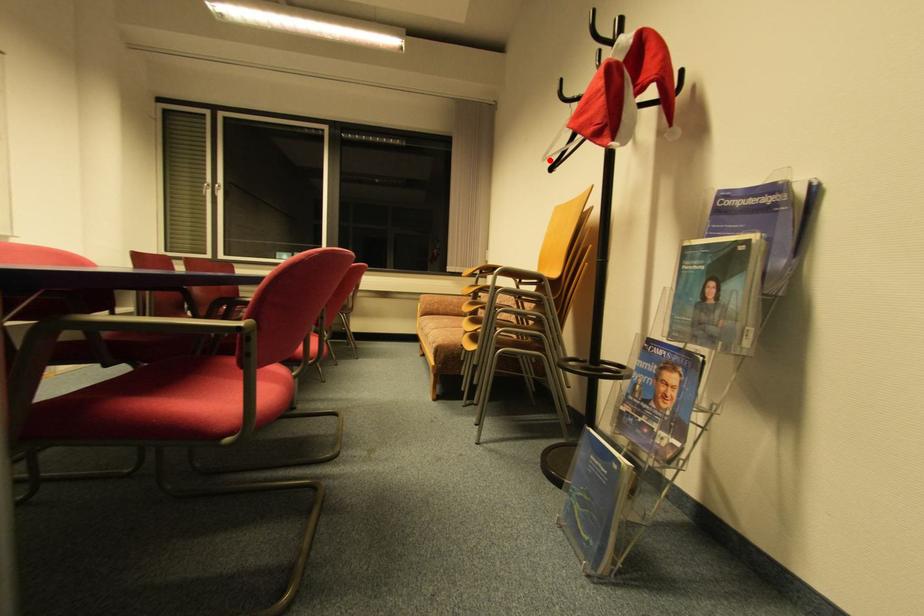
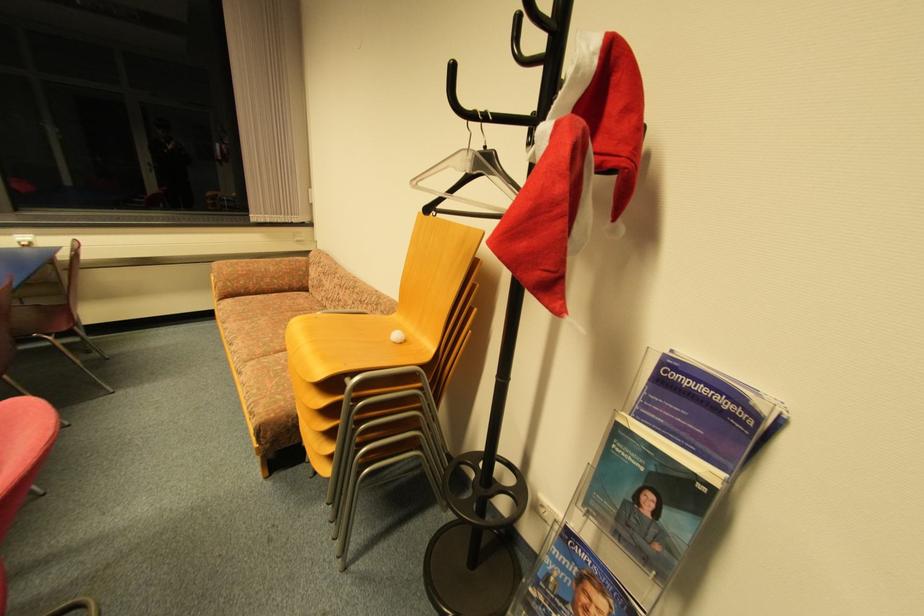
Where in the second image is the point corresponding to the highlighted location from the first image?

(419, 184)